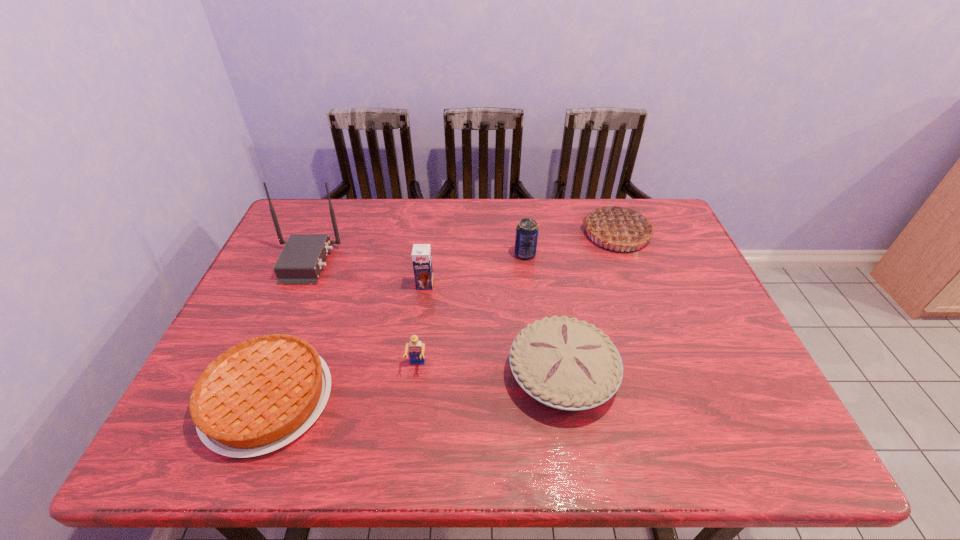
This screenshot has width=960, height=540. Find the location of `vacant region located on the left of the tallest pie`. vacant region located on the left of the tallest pie is located at coordinates (466, 233).

Identify the location of free spot located on the front label of the chocolate milk. (416, 355).

I want to click on free point located on the front of the soda, so click(536, 341).

Identify the location of vacant region located on the face of the Lego. The width and height of the screenshot is (960, 540). (412, 406).

Find the location of a particular element. vacant region located on the back of the second tallest pie is located at coordinates 546,275.

The height and width of the screenshot is (540, 960). I want to click on free space located on the right of the shortest pie, so click(431, 399).

Identify the location of object that is at the far edge. (619, 226).

At what (x,y) coordinates should I click in order to perform the action: click on router present at the left edge. Please return your answer as a coordinate pair (x, y). Looking at the image, I should click on click(300, 262).

Locate an element on the screen. pie located in the left edge section of the desktop is located at coordinates (258, 396).

You are a GUI agent. You are given a task and a screenshot of the screen. Output one action in this format:
    pyautogui.click(x=<x>, y=<y>)
    Task: Click on the object positioned at the right edge
    The width and height of the screenshot is (960, 540).
    Given the screenshot: What is the action you would take?
    pyautogui.click(x=619, y=226)